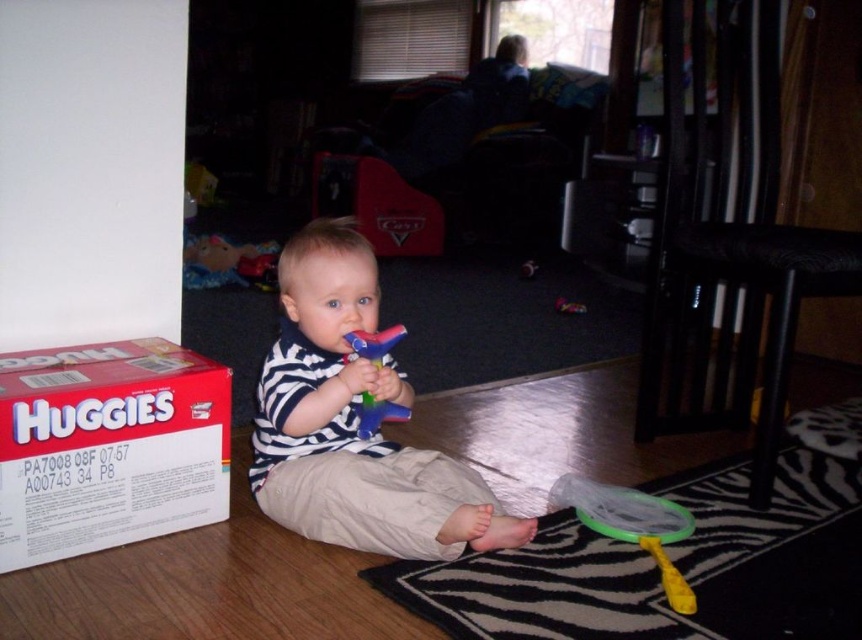
Question: Which of these objects is positioned farthest from the striped fabric shirt at center?

Choices:
 (A) red cardboard box at lower left
 (B) rubber duck at center

Answer: (A)

Question: Is striped fabric shirt at center below red cardboard box at lower left?

Choices:
 (A) yes
 (B) no

Answer: (B)

Question: Can you confirm if striped fabric shirt at center is bigger than rubber duck at center?

Choices:
 (A) yes
 (B) no

Answer: (A)

Question: Considering the real-world distances, which object is farthest from the red cardboard box at lower left?

Choices:
 (A) rubber duck at center
 (B) striped fabric shirt at center

Answer: (A)

Question: Is striped fabric shirt at center behind rubber duck at center?

Choices:
 (A) no
 (B) yes

Answer: (B)

Question: Which point is farther to the camera?

Choices:
 (A) (59, 360)
 (B) (420, 484)
 (C) (379, 348)

Answer: (B)